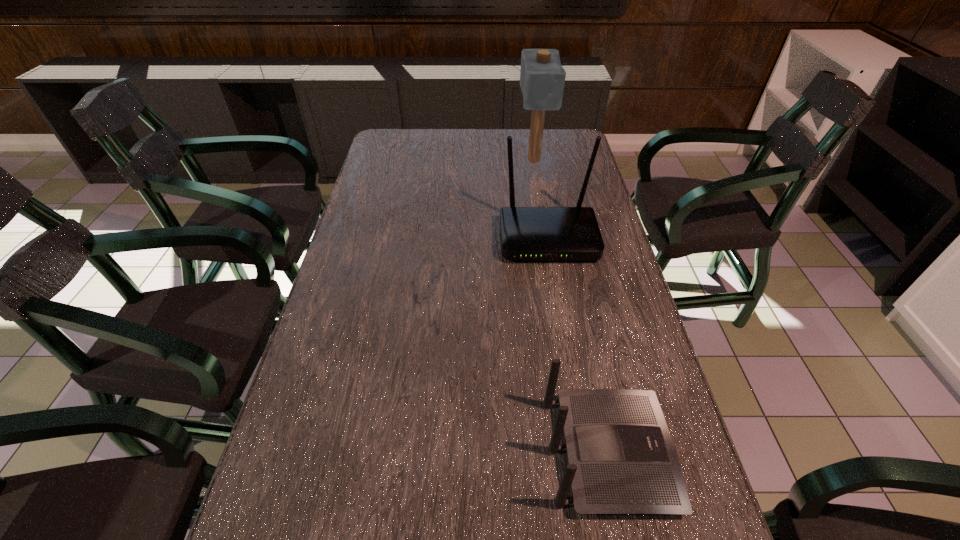
This screenshot has height=540, width=960. What are the coordinates of `object present at the far right corner` in the screenshot? It's located at (542, 77).

I want to click on vacant region at the far edge of the desktop, so click(x=426, y=151).

At what (x,y) coordinates should I click in order to perform the action: click on free region at the left edge. Please return your answer as a coordinate pair (x, y). Looking at the image, I should click on (390, 233).

This screenshot has width=960, height=540. What are the coordinates of `free space at the right edge of the desktop` in the screenshot? It's located at (593, 191).

Locate an element on the screen. Image resolution: width=960 pixels, height=540 pixels. vacant space at the far left corner is located at coordinates (420, 140).

At what (x,y) coordinates should I click in order to perform the action: click on blank space at the far right corner. Please return your answer as a coordinate pair (x, y). This screenshot has width=960, height=540. Looking at the image, I should click on (547, 146).

At what (x,y) coordinates should I click in order to perform the action: click on vacant area that lies between the nearer router and the second shortest object. Please return your answer as a coordinate pair (x, y). Looking at the image, I should click on (578, 346).

The width and height of the screenshot is (960, 540). What are the coordinates of `free area in between the second tallest object and the shortest object` in the screenshot? It's located at (578, 346).

You are a GUI agent. You are given a task and a screenshot of the screen. Output one action in this format:
    pyautogui.click(x=<x>, y=<y>)
    Task: Click on the free spot between the nearer router and the mallet
    
    Given the screenshot: What is the action you would take?
    pyautogui.click(x=571, y=306)

Locate an element on the screen. This screenshot has height=540, width=960. vacant space in between the tallest object and the taller router is located at coordinates (540, 199).